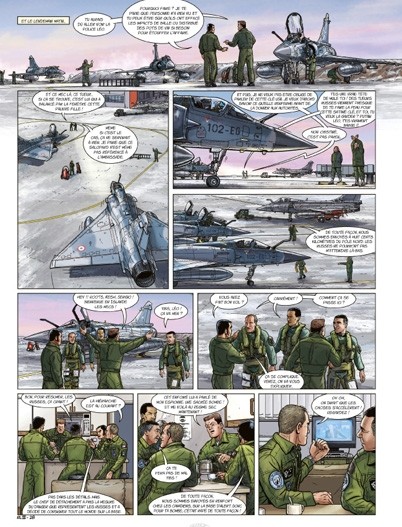
Where is `monitors`? This screenshot has width=402, height=527. monitors is located at coordinates (336, 432), (269, 425).